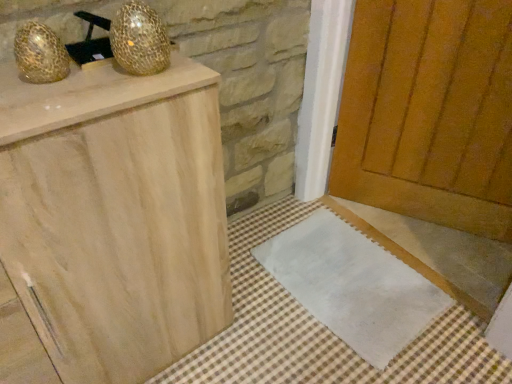
Question: In the image, is gold mesh disco ball at upper left, the first disco ball when ordered from right to left, on the left side or the right side of wooden door at center?

Choices:
 (A) right
 (B) left

Answer: (B)

Question: Looking at their shapes, would you say gold mesh disco ball at upper left, the first disco ball when ordered from right to left, is wider or thinner than wooden door at center?

Choices:
 (A) wide
 (B) thin

Answer: (B)

Question: Which object is the farthest from the gold mesh disco ball at upper left, the 2th disco ball when ordered from left to right?

Choices:
 (A) natural wood cabinet at left
 (B) white fabric doormat at lower center
 (C) gold textured egg at upper left, the second disco ball viewed from the right
 (D) wooden door at center

Answer: (D)

Question: Estimate the real-world distances between objects in this image. Which object is farther from the white fabric doormat at lower center?

Choices:
 (A) gold mesh disco ball at upper left, the first disco ball when ordered from right to left
 (B) natural wood cabinet at left
 (C) wooden door at center
 (D) gold textured egg at upper left, the 1th disco ball in the left-to-right sequence

Answer: (D)